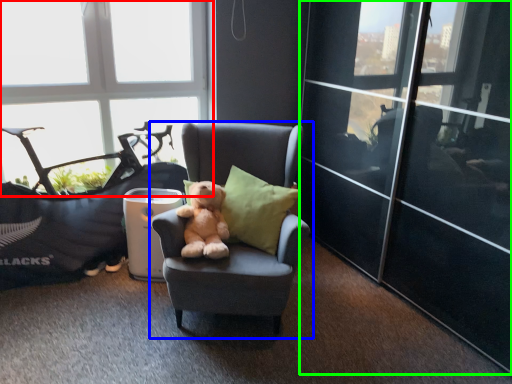
Question: Considering the real-world distances, which object is closest to window (highlighted by a red box)? chair (highlighted by a blue box) or glass door (highlighted by a green box).

Choices:
 (A) chair
 (B) glass door

Answer: (A)